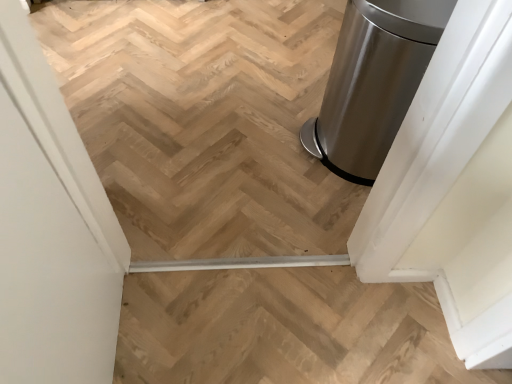
You are a GUI agent. You are given a task and a screenshot of the screen. Output one action in this format:
    pyautogui.click(x=<x>, y=<y>)
    Task: Click on the satin silver trash can at right
    This screenshot has height=384, width=512.
    Given the screenshot: What is the action you would take?
    pyautogui.click(x=373, y=82)

The height and width of the screenshot is (384, 512). Identify the location of satin metallic trash can at right. (204, 121).

Find the location of `satin silver trash can at right`. satin silver trash can at right is located at coordinates (373, 82).

Does satin metallic trash can at right appear on the left side of white matte screen door at left?

Incorrect, satin metallic trash can at right is not on the left side of white matte screen door at left.

From the image's perspective, does satin metallic trash can at right appear higher than white matte screen door at left?

Yes, from the image's perspective, satin metallic trash can at right is on top of white matte screen door at left.

Between satin silver trash can at right and white matte screen door at left, which one has less height?

satin silver trash can at right is shorter.

From the image's perspective, which one is positioned higher, satin silver trash can at right or white matte screen door at left?

From the image's view, satin silver trash can at right is above.

Can you see satin silver trash can at right touching white matte screen door at left?

satin silver trash can at right is not next to white matte screen door at left, and they're not touching.

Is the depth of satin silver trash can at right greater than that of white matte screen door at left?

Yes, satin silver trash can at right is further from the camera.

Is white matte screen door at left positioned before natural wood stairs at center?

Yes, it is in front of natural wood stairs at center.

Can you confirm if white matte screen door at left is shorter than natural wood stairs at center?

No.

Are white matte screen door at left and natural wood stairs at center located far from each other?

No, there isn't a large distance between white matte screen door at left and natural wood stairs at center.

Which is closer to the camera, (83,34) or (399,101)?

Clearly, point (83,34) is more distant from the camera than point (399,101).

Which is correct: satin metallic trash can at right is inside satin silver trash can at right, or outside of it?

satin metallic trash can at right is not enclosed by satin silver trash can at right.

Where is `waste container that appears in front of the satin metallic trash can at right`? The height and width of the screenshot is (384, 512). waste container that appears in front of the satin metallic trash can at right is located at coordinates (373, 82).

Does satin metallic trash can at right touch satin silver trash can at right?

No, satin metallic trash can at right is not making contact with satin silver trash can at right.

From a real-world perspective, which object stands above the other?

satin silver trash can at right, from a real-world perspective.

Is natural wood stairs at center located within satin silver trash can at right?

No, satin silver trash can at right does not contain natural wood stairs at center.

From the image's perspective, which is above, satin silver trash can at right or natural wood stairs at center?

From the image's view, satin silver trash can at right is above.

Is natural wood stairs at center beside white matte screen door at left?

There is a gap between natural wood stairs at center and white matte screen door at left.

What's the angular difference between natural wood stairs at center and white matte screen door at left's facing directions?

180 degrees separate the facing orientations of natural wood stairs at center and white matte screen door at left.

Is point (204, 334) positioned in front of point (127, 254)?

Yes, point (204, 334) is closer to viewer.

Considering the positions of objects natural wood stairs at center and satin silver trash can at right in the image provided, who is more to the right, natural wood stairs at center or satin silver trash can at right?

satin silver trash can at right.

Is point (485, 370) farther from camera compared to point (372, 163)?

That is False.

Who is shorter, natural wood stairs at center or satin silver trash can at right?

natural wood stairs at center is shorter.

Looking at this image, considering the sizes of objects natural wood stairs at center and satin silver trash can at right in the image provided, who is bigger, natural wood stairs at center or satin silver trash can at right?

With larger size is satin silver trash can at right.

This screenshot has width=512, height=384. I want to click on stairwell beneath the white matte screen door at left (from a real-world perspective), so click(x=204, y=121).

The width and height of the screenshot is (512, 384). Identify the location of screen door on the left of satin silver trash can at right. (51, 229).

Considering their positions, is satin metallic trash can at right positioned closer to satin silver trash can at right than white matte screen door at left?

satin metallic trash can at right is positioned closer to the anchor satin silver trash can at right.

When comparing their distances from white matte screen door at left, does satin metallic trash can at right or natural wood stairs at center seem closer?

The object closer to white matte screen door at left is natural wood stairs at center.

Which object lies further to the anchor point satin metallic trash can at right, white matte screen door at left or natural wood stairs at center?

Based on the image, white matte screen door at left appears to be further to satin metallic trash can at right.

From the image, which object appears to be nearer to satin metallic trash can at right, natural wood stairs at center or white matte screen door at left?

Based on the image, natural wood stairs at center appears to be nearer to satin metallic trash can at right.

Considering their positions, is satin silver trash can at right positioned further to white matte screen door at left than natural wood stairs at center?

satin silver trash can at right is positioned further to the anchor white matte screen door at left.

Which object lies nearer to the anchor point satin metallic trash can at right, satin silver trash can at right or white matte screen door at left?

satin silver trash can at right is positioned closer to the anchor satin metallic trash can at right.

From the image, which object appears to be farther from satin metallic trash can at right, white matte screen door at left or satin silver trash can at right?

white matte screen door at left is positioned further to the anchor satin metallic trash can at right.

Considering their positions, is satin metallic trash can at right positioned further to satin silver trash can at right than natural wood stairs at center?

Based on the image, natural wood stairs at center appears to be further to satin silver trash can at right.

The height and width of the screenshot is (384, 512). What are the coordinates of `waste container between satin metallic trash can at right and natural wood stairs at center vertically` in the screenshot? It's located at (x=373, y=82).

Image resolution: width=512 pixels, height=384 pixels. I want to click on waste container between white matte screen door at left and satin metallic trash can at right from front to back, so click(x=373, y=82).

At what (x,y) coordinates should I click in order to perform the action: click on stairs between white matte screen door at left and satin silver trash can at right. Please return your answer as a coordinate pair (x, y). Looking at the image, I should click on (284, 330).

At what (x,y) coordinates should I click in order to perform the action: click on stairs between white matte screen door at left and satin metallic trash can at right in the front-back direction. Please return your answer as a coordinate pair (x, y). The width and height of the screenshot is (512, 384). Looking at the image, I should click on (284, 330).